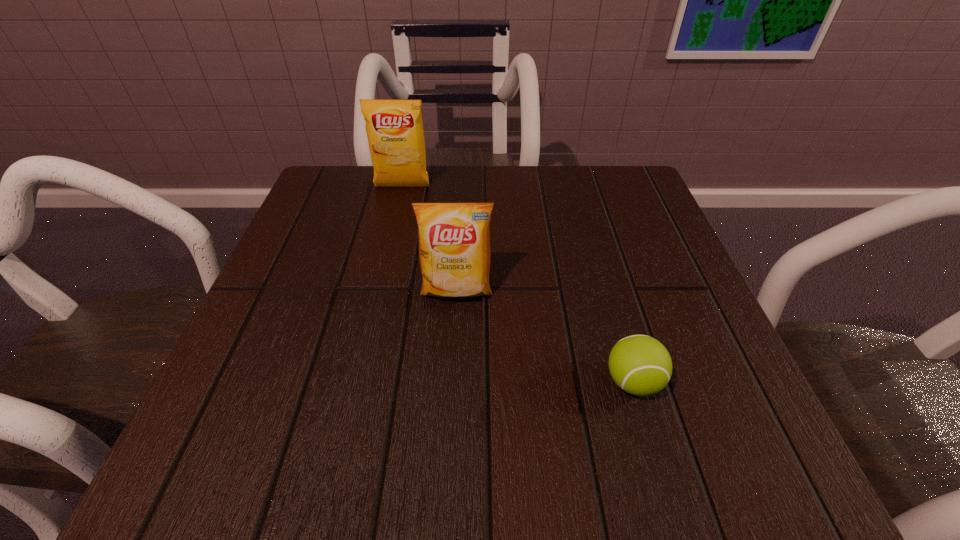
You are a GUI agent. You are given a task and a screenshot of the screen. Output one action in this format:
    pyautogui.click(x=<x>, y=<y>)
    Task: Click on the vacant region that satisfies the following two spatial constraints: 1. on the front-facing side of the second farthest object; 2. on the left side of the shortest object
    This screenshot has height=540, width=960.
    Given the screenshot: What is the action you would take?
    pyautogui.click(x=451, y=382)

At what (x,y) coordinates should I click in order to perform the action: click on vacant space that satisfies the following two spatial constraints: 1. on the front-facing side of the shortest object; 2. on the left side of the second shortest object. Please return your answer as a coordinate pair (x, y). This screenshot has height=540, width=960. Looking at the image, I should click on click(x=451, y=382).

Where is `free space in the image that satisfies the following two spatial constraints: 1. on the front of the leftmost object with the logo; 2. on the right side of the shortest object`? This screenshot has height=540, width=960. free space in the image that satisfies the following two spatial constraints: 1. on the front of the leftmost object with the logo; 2. on the right side of the shortest object is located at coordinates (357, 382).

Where is `vacant space that satisfies the following two spatial constraints: 1. on the front-facing side of the second object from right to left; 2. on the left side of the shortest object`? vacant space that satisfies the following two spatial constraints: 1. on the front-facing side of the second object from right to left; 2. on the left side of the shortest object is located at coordinates (451, 382).

Locate an element on the screen. The height and width of the screenshot is (540, 960). vacant space that satisfies the following two spatial constraints: 1. on the front of the tallest object with the logo; 2. on the right side of the rightmost object is located at coordinates (357, 382).

Find the location of a particular element. Image resolution: width=960 pixels, height=540 pixels. vacant space that satisfies the following two spatial constraints: 1. on the front-facing side of the second object from left to right; 2. on the left side of the shortest object is located at coordinates (451, 382).

You are a GUI agent. You are given a task and a screenshot of the screen. Output one action in this format:
    pyautogui.click(x=<x>, y=<y>)
    Task: Click on the vacant space that satisfies the following two spatial constraints: 1. on the front of the taller crisp (potato chip) with the logo; 2. on the right side of the shortest object
    This screenshot has height=540, width=960.
    Given the screenshot: What is the action you would take?
    pyautogui.click(x=357, y=382)

At what (x,y) coordinates should I click in order to perform the action: click on free location that satisfies the following two spatial constraints: 1. on the front-facing side of the nearest object; 2. on the left side of the right crisp (potato chip). Please return your answer as a coordinate pair (x, y). The image size is (960, 540). Looking at the image, I should click on (451, 382).

The height and width of the screenshot is (540, 960). What are the coordinates of `vacant space that satisfies the following two spatial constraints: 1. on the front of the nearest object with the logo; 2. on the right side of the leftmost object` in the screenshot? It's located at (357, 382).

I want to click on free spot that satisfies the following two spatial constraints: 1. on the front of the farthest object with the logo; 2. on the left side of the tennis ball, so [x=357, y=382].